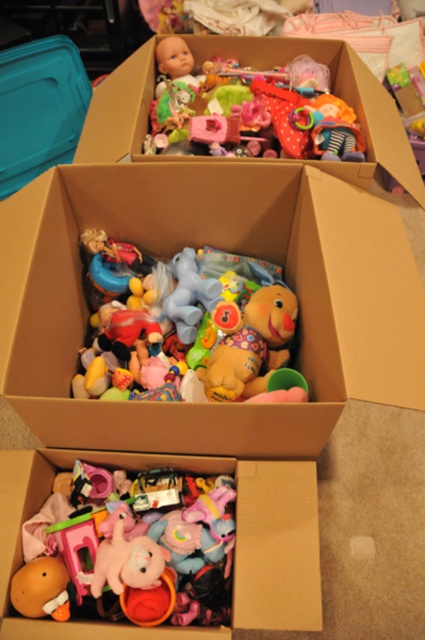
Which is in front, point (244, 380) or point (223, 529)?

Point (223, 529) is more forward.

From the picture: Which of these two, soft plush duck at center or soft plush toy at lower center, stands taller?

Standing taller between the two is soft plush duck at center.

Between point (229, 362) and point (226, 500), which one is positioned in front?

Point (226, 500) is more forward.

Identify the location of soft plush duck at center. (203, 332).

Who is positioned more to the left, soft plush toys at center or multicolored plush toys at upper center?

soft plush toys at center

Does soft plush toys at center have a smaller size compared to multicolored plush toys at upper center?

No.

Between point (76, 250) and point (340, 173), which one is positioned in front?

Point (340, 173)

Image resolution: width=425 pixels, height=640 pixels. What are the coordinates of `soft plush toys at center` in the screenshot? It's located at (221, 248).

Who is shorter, soft plush toy at lower center or multicolored plush toys at upper center?

soft plush toy at lower center

Is soft plush toy at lower center bigger than multicolored plush toys at upper center?

Actually, soft plush toy at lower center might be smaller than multicolored plush toys at upper center.

Is point (221, 609) less distant than point (265, 54)?

Yes, it is in front of point (265, 54).

Locate an element on the screen. Image resolution: width=425 pixels, height=640 pixels. soft plush toy at lower center is located at coordinates (130, 544).